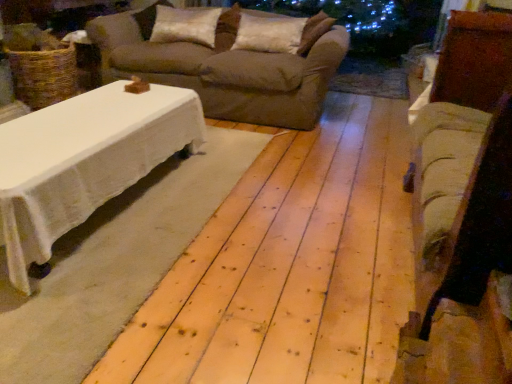
Question: Considering the relative positions of satin white pillow at center, which ranks as the 1th pillow in right-to-left order, and white soft pillow at upper center, which is the first pillow from left to right, in the image provided, is satin white pillow at center, which ranks as the 1th pillow in right-to-left order, to the left or to the right of white soft pillow at upper center, which is the first pillow from left to right,?

Choices:
 (A) left
 (B) right

Answer: (B)

Question: In the image, is satin white pillow at center, which ranks as the 2th pillow in left-to-right order, positioned in front of or behind white soft pillow at upper center, which is the first pillow from left to right?

Choices:
 (A) front
 (B) behind

Answer: (A)

Question: Considering the real-world distances, which object is closest to the velvet beige armchair at right?

Choices:
 (A) white soft pillow at upper center, the second pillow when ordered from right to left
 (B) beige fabric couch at center
 (C) satin white pillow at center, which ranks as the 2th pillow in left-to-right order

Answer: (B)

Question: Based on their relative distances, which object is nearer to the white soft pillow at upper center, which is the first pillow from left to right?

Choices:
 (A) beige fabric couch at center
 (B) velvet beige armchair at right
 (C) satin white pillow at center, which ranks as the 1th pillow in right-to-left order

Answer: (A)